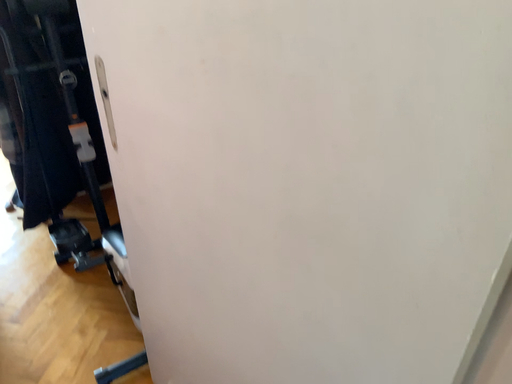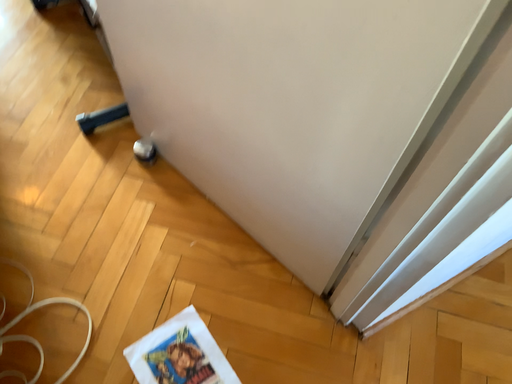
Question: How did the camera likely rotate when shooting the video?

Choices:
 (A) rotated upward
 (B) rotated downward

Answer: (B)